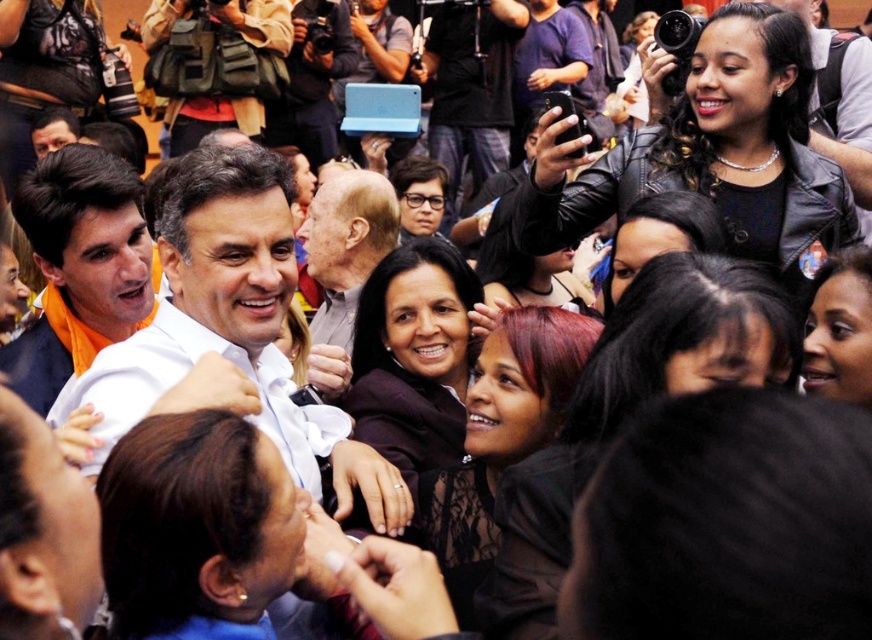
Is dark brown fabric at center bigger than dark skin smooth face at center?

Incorrect, dark brown fabric at center is not larger than dark skin smooth face at center.

Consider the image. Is dark brown fabric at center taller than dark skin smooth face at center?

No, dark brown fabric at center is not taller than dark skin smooth face at center.

What do you see at coordinates (413, 356) in the screenshot? I see `dark brown fabric at center` at bounding box center [413, 356].

You are a GUI agent. You are given a task and a screenshot of the screen. Output one action in this format:
    pyautogui.click(x=<x>, y=<y>)
    Task: Click on the dark brown fabric at center
    This screenshot has width=872, height=640.
    Given the screenshot: What is the action you would take?
    pyautogui.click(x=413, y=356)

Does black leather jacket at upper right appear under gray hair at center?

Incorrect, black leather jacket at upper right is not positioned below gray hair at center.

Does black leather jacket at upper right have a lesser width compared to gray hair at center?

In fact, black leather jacket at upper right might be wider than gray hair at center.

What are the coordinates of `black leather jacket at upper right` in the screenshot? It's located at (707, 156).

Find the location of `black leather jacket at upper right`. black leather jacket at upper right is located at coordinates (707, 156).

Does dark red hair at center have a greater height compared to dark skin smooth face at center?

No.

Can you confirm if dark red hair at center is smaller than dark skin smooth face at center?

Correct, dark red hair at center occupies less space than dark skin smooth face at center.

Is point (495, 378) positioned before point (839, 340)?

No, (495, 378) is further to viewer.

You are a GUI agent. You are given a task and a screenshot of the screen. Output one action in this format:
    pyautogui.click(x=<x>, y=<y>)
    Task: Click on the dark red hair at center
    
    Given the screenshot: What is the action you would take?
    pyautogui.click(x=499, y=438)